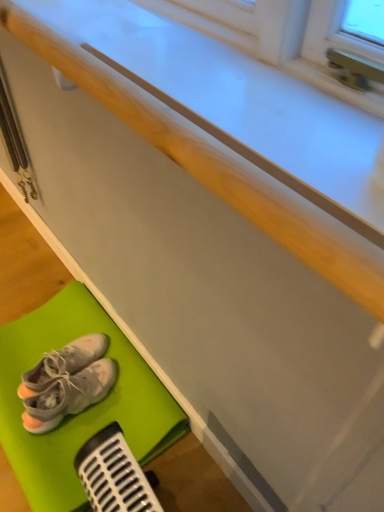
Locate an element on the screen. This screenshot has width=384, height=512. blank space situated above green rubber bath mat at lower left (from a real-world perspective) is located at coordinates (66, 387).